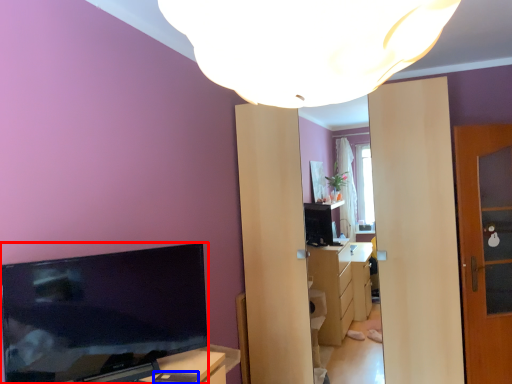
Question: Among these objects, which one is nearest to the camera, television (highlighted by a red box) or mobile phone (highlighted by a blue box)?

Choices:
 (A) television
 (B) mobile phone

Answer: (A)